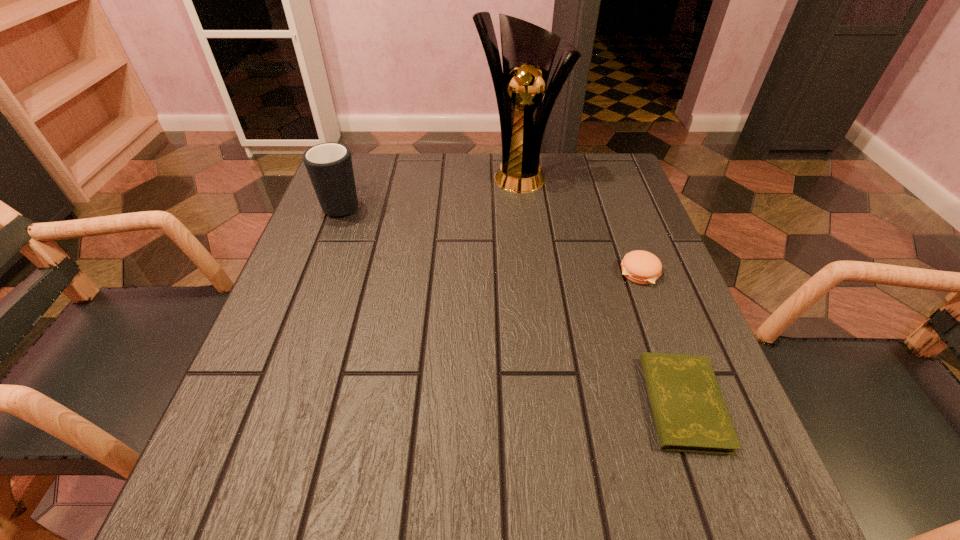
Find the location of `free location that satisfies the following two spatial constraints: 1. at the front of the nearest object, where the globe is visible; 2. on the right side of the award`. free location that satisfies the following two spatial constraints: 1. at the front of the nearest object, where the globe is visible; 2. on the right side of the award is located at coordinates (544, 403).

This screenshot has width=960, height=540. What are the coordinates of `blank area in the image that satisfies the following two spatial constraints: 1. at the front of the second nearest object, where the globe is visible; 2. on the left side of the award` in the screenshot? It's located at (529, 273).